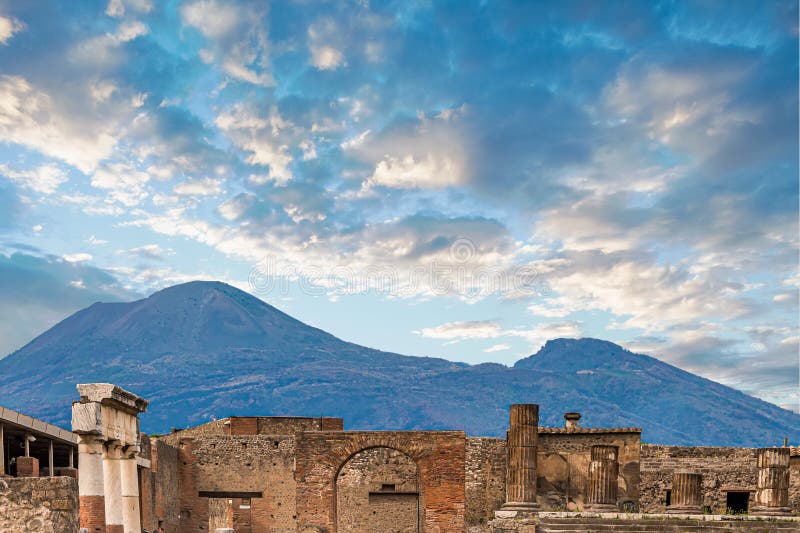
Where is `pillar`? pillar is located at coordinates (518, 457).